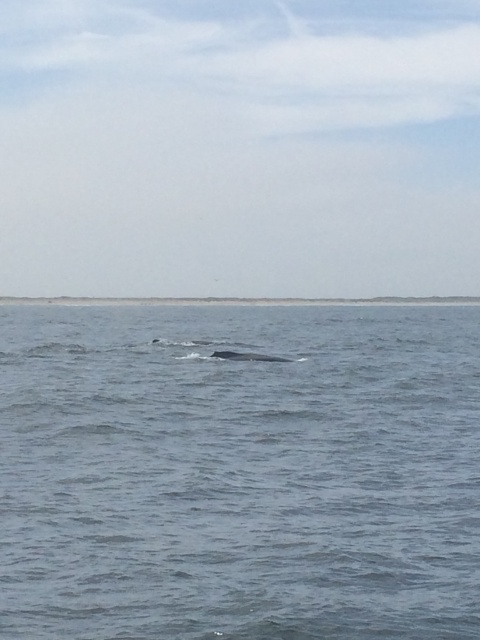
You are a marine biologist observing the seascape. You notice the gray matte water at center. Can you determine its exact location in the image using coordinates?

The gray matte water at center is located at coordinates point (239,472).

You are a marine biologist observing the seascape. You notice the gray matte water at center and the gray matte whale at center. Which object takes up more space in the image?

The gray matte water at center has a larger size compared to the gray matte whale at center, so the gray matte water at center takes up more space in the image.

You are standing on a boat anchored in the middle of the ocean. You see the gray matte water at center and the gray matte whale at center. How far apart are these two objects from each other?

The gray matte water at center is 28.01 meters away from the gray matte whale at center.